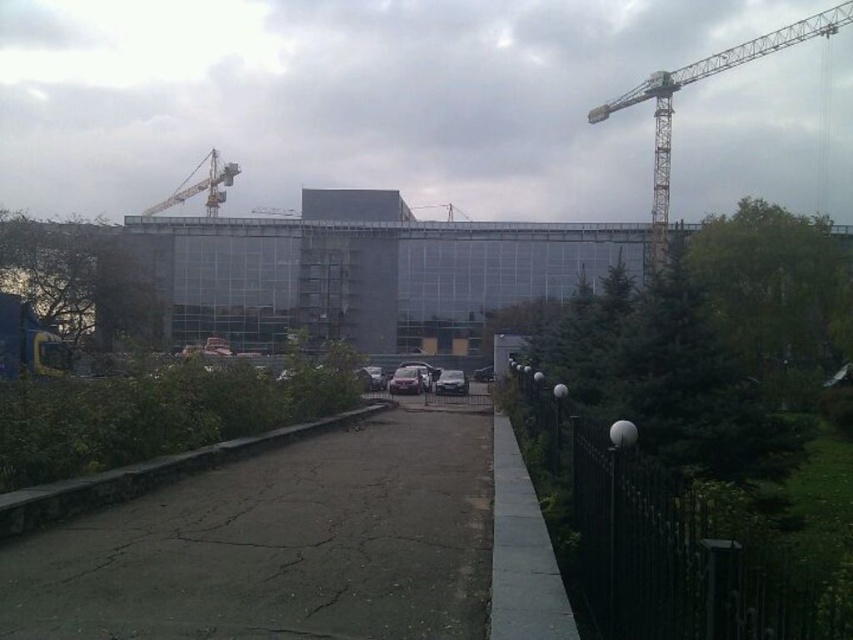
You are a delivery driver approaching the construction site and need to park your shiny silver car at center. There is a yellow metallic crane at upper right blocking part of the parking area. Can you safely park your car without hitting the crane?

The yellow metallic crane at upper right is closer to the viewer than the shiny silver car at center, so the crane is in a position that might block the parking area. However, since the crane is closer, it might not be directly in front of the parking spot. You should carefully assess the distance and angle to ensure safe parking without collision.

You are a construction worker standing at the point marked by the coordinates point (692, 83). You need to move towards the building. Which direction should you go to avoid the fenced area?

The point (692, 83) indicates the yellow metallic crane at upper right. To avoid the fenced area, you should move towards the building by going towards the left, as the fence is on the right side of the pathway.